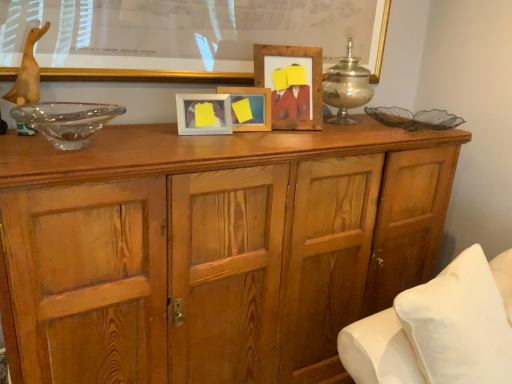
Find the location of `free space in front of matte wooden picture frame at center, the third picture frame positioned from the right`. free space in front of matte wooden picture frame at center, the third picture frame positioned from the right is located at coordinates [x=182, y=133].